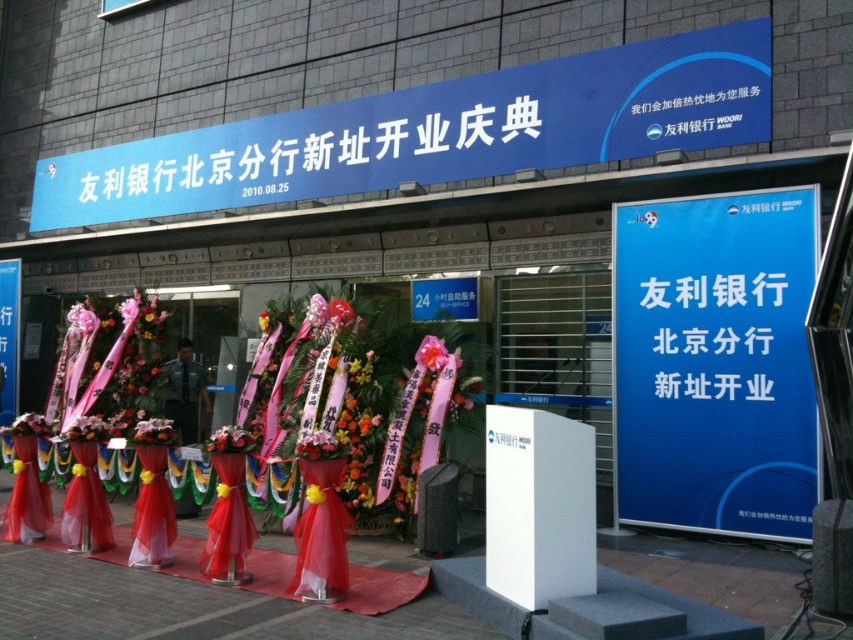
Question: Which object appears farthest from the camera in this image?

Choices:
 (A) blue paperboard sign at right
 (B) pink matte flower at center

Answer: (B)

Question: Which of the following is the closest to the observer?

Choices:
 (A) pink matte flower at center
 (B) blue paperboard sign at right

Answer: (B)

Question: Is blue paperboard sign at right positioned behind pink matte flower at center?

Choices:
 (A) yes
 (B) no

Answer: (B)

Question: Is blue paperboard sign at right further to the viewer compared to pink matte flower at center?

Choices:
 (A) no
 (B) yes

Answer: (A)

Question: Which point is farther to the camera?

Choices:
 (A) blue paperboard sign at right
 (B) pink matte flower at center

Answer: (B)

Question: Does blue paperboard sign at right have a smaller size compared to pink matte flower at center?

Choices:
 (A) yes
 (B) no

Answer: (B)